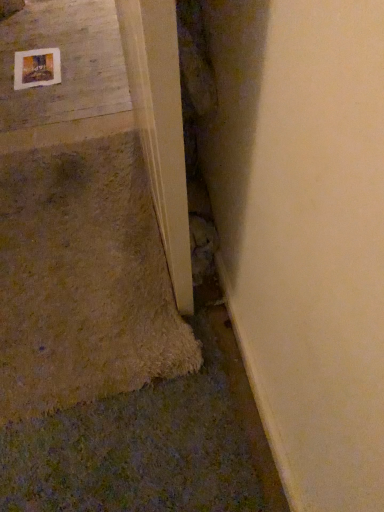
Question: Is smooth concrete at upper left placed right next to wooden frame at upper left?

Choices:
 (A) yes
 (B) no

Answer: (B)

Question: Is smooth concrete at upper left smaller than wooden frame at upper left?

Choices:
 (A) yes
 (B) no

Answer: (B)

Question: Is wooden frame at upper left a part of smooth concrete at upper left?

Choices:
 (A) no
 (B) yes

Answer: (B)

Question: Considering the relative sizes of smooth concrete at upper left and wooden frame at upper left in the image provided, is smooth concrete at upper left bigger than wooden frame at upper left?

Choices:
 (A) no
 (B) yes

Answer: (B)

Question: From a real-world perspective, does smooth concrete at upper left sit lower than wooden frame at upper left?

Choices:
 (A) yes
 (B) no

Answer: (A)

Question: Does smooth concrete at upper left appear on the right side of wooden frame at upper left?

Choices:
 (A) yes
 (B) no

Answer: (A)

Question: Is smooth concrete at upper left directly adjacent to light wood door frame at lower left?

Choices:
 (A) yes
 (B) no

Answer: (B)

Question: Considering the relative positions of smooth concrete at upper left and light wood door frame at lower left in the image provided, is smooth concrete at upper left to the left of light wood door frame at lower left from the viewer's perspective?

Choices:
 (A) yes
 (B) no

Answer: (A)

Question: From a real-world perspective, is smooth concrete at upper left on top of light wood door frame at lower left?

Choices:
 (A) yes
 (B) no

Answer: (B)

Question: From a real-world perspective, is smooth concrete at upper left located beneath light wood door frame at lower left?

Choices:
 (A) no
 (B) yes

Answer: (B)

Question: Is smooth concrete at upper left oriented away from light wood door frame at lower left?

Choices:
 (A) no
 (B) yes

Answer: (A)

Question: Is smooth concrete at upper left not near light wood door frame at lower left?

Choices:
 (A) yes
 (B) no

Answer: (A)

Question: Is light wood door frame at lower left thinner than wooden frame at upper left?

Choices:
 (A) no
 (B) yes

Answer: (B)